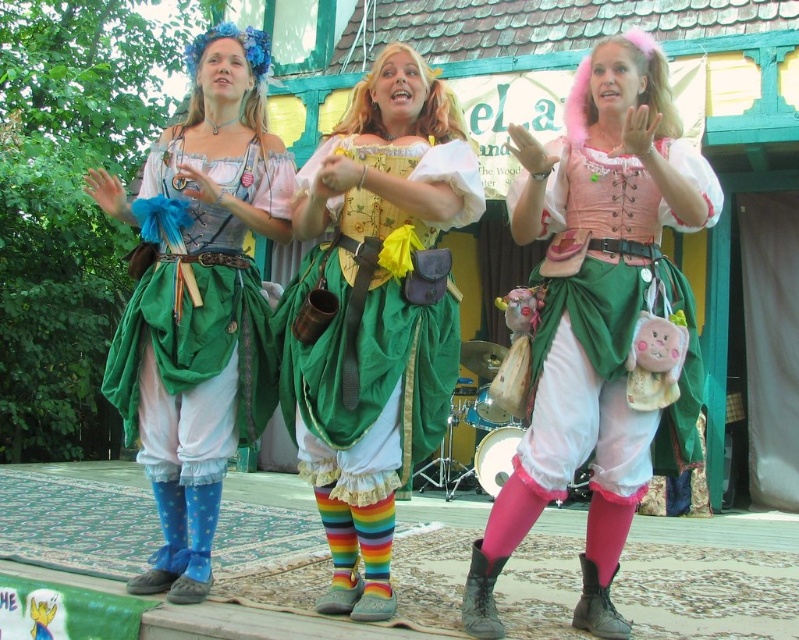
Does pink matte skirt at center have a lesser height compared to matte yellow corset at center?

Yes.

This screenshot has height=640, width=799. Identify the location of pink matte skirt at center. (599, 321).

Identify the location of pink matte skirt at center. (599, 321).

Measure the distance between pink matte skirt at center and camera.

pink matte skirt at center is 16.19 meters from camera.

Based on the photo, is pink matte skirt at center below matte blue fabric dress at left?

Yes, pink matte skirt at center is below matte blue fabric dress at left.

Locate an element on the screen. pink matte skirt at center is located at coordinates (599, 321).

Who is lower down, matte yellow corset at center or matte blue fabric dress at left?

matte yellow corset at center

Can you confirm if matte yellow corset at center is positioned to the left of matte blue fabric dress at left?

No, matte yellow corset at center is not to the left of matte blue fabric dress at left.

Where is `matte yellow corset at center`? The image size is (799, 640). matte yellow corset at center is located at coordinates tap(374, 314).